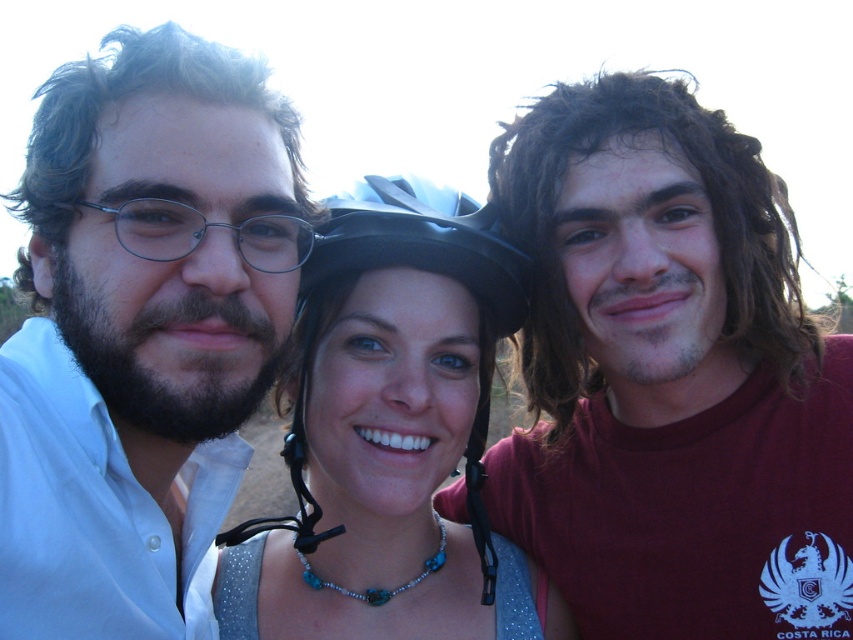
Question: Among these points, which one is farthest from the camera?

Choices:
 (A) (305, 248)
 (B) (225, 360)
 (C) (426, 476)
 (D) (410, 227)

Answer: (C)

Question: Which of the following is the closest to the observer?

Choices:
 (A) matte black glasses at left
 (B) black matte helmet at center
 (C) matte white shirt at left

Answer: (C)

Question: Does matte black helmet at upper center have a lesser width compared to matte white shirt at left?

Choices:
 (A) yes
 (B) no

Answer: (B)

Question: From the image, what is the correct spatial relationship of matte white shirt at left in relation to black matte helmet at center?

Choices:
 (A) left
 (B) right

Answer: (A)

Question: Does matte white shirt at left appear on the left side of black matte helmet at center?

Choices:
 (A) yes
 (B) no

Answer: (A)

Question: Which of the following is the closest to the observer?

Choices:
 (A) matte black glasses at left
 (B) matte black helmet at center

Answer: (A)